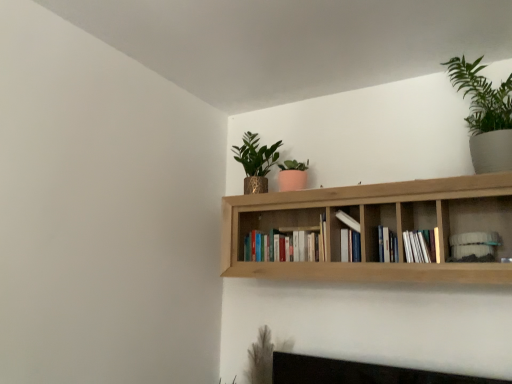
Question: Is natural wood bookshelf at upper center not close to white matte bookshelf at upper right, the 1th book viewed from the right?

Choices:
 (A) yes
 (B) no

Answer: (B)

Question: From the image's perspective, is natural wood bookshelf at upper center on white matte bookshelf at upper right, the 5th book in the left-to-right sequence?

Choices:
 (A) no
 (B) yes

Answer: (B)

Question: From the image's perspective, is natural wood bookshelf at upper center located beneath white matte bookshelf at upper right, the 1th book viewed from the right?

Choices:
 (A) yes
 (B) no

Answer: (B)

Question: Is natural wood bookshelf at upper center next to white matte bookshelf at upper right, the 1th book viewed from the right?

Choices:
 (A) no
 (B) yes

Answer: (A)

Question: Is natural wood bookshelf at upper center positioned with its back to white matte bookshelf at upper right, the 5th book in the left-to-right sequence?

Choices:
 (A) no
 (B) yes

Answer: (B)

Question: From a real-world perspective, is natural wood bookshelf at upper center physically below white matte bookshelf at upper right, the 5th book in the left-to-right sequence?

Choices:
 (A) no
 (B) yes

Answer: (A)

Question: Does hardcover books at center, which appears as the fifth book when viewed from the right, have a smaller size compared to natural wood bookshelf at upper center?

Choices:
 (A) no
 (B) yes

Answer: (B)

Question: Does hardcover books at center, which appears as the fifth book when viewed from the right, contain natural wood bookshelf at upper center?

Choices:
 (A) yes
 (B) no

Answer: (B)

Question: From the image's perspective, is hardcover books at center, which appears as the fifth book when viewed from the right, below natural wood bookshelf at upper center?

Choices:
 (A) no
 (B) yes

Answer: (B)

Question: Is hardcover books at center, which appears as the fifth book when viewed from the right, facing away from natural wood bookshelf at upper center?

Choices:
 (A) yes
 (B) no

Answer: (A)

Question: Is hardcover books at center, which is the first book from left to right, behind natural wood bookshelf at upper center?

Choices:
 (A) no
 (B) yes

Answer: (B)

Question: Is hardcover books at center, which appears as the fifth book when viewed from the right, wider than natural wood bookshelf at upper center?

Choices:
 (A) yes
 (B) no

Answer: (B)

Question: From a real-world perspective, is white paper book at center-right, arranged as the 4th book when viewed from the left, beneath natural wood bookshelf at upper center?

Choices:
 (A) yes
 (B) no

Answer: (A)